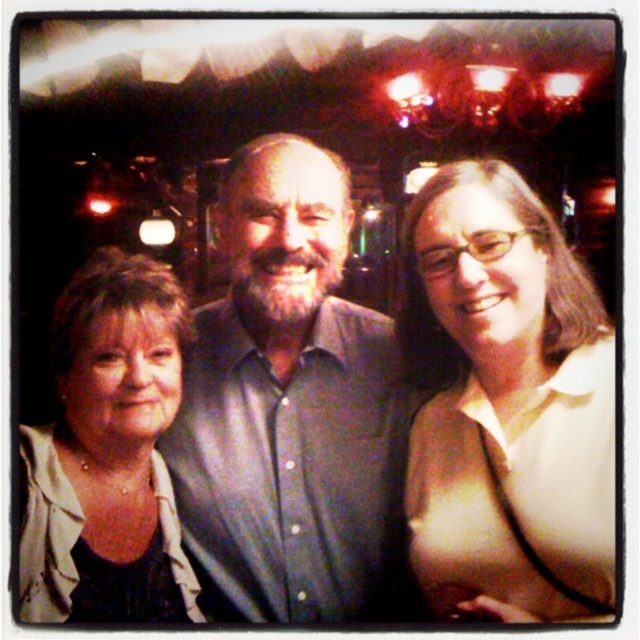
You are organizing a clothing display and need to place the matte white shirt at center and the matte beige jacket at lower left side by side. Based on their sizes, which one should be placed on the shelf first to ensure they fit properly?

The matte white shirt at center is wider than the matte beige jacket at lower left. Therefore, you should place the matte white shirt at center first to accommodate its greater width before positioning the matte beige jacket at lower left.

In the scene shown: You are at a party and need to find the matte white shirt at center and the matte beige jacket at lower left. Which one is higher in the image?

The matte white shirt at center is located above the matte beige jacket at lower left, so it is higher in the image.

You are a photographer trying to adjust the lighting for a group photo. You notice the matte green shirt at center and the matte beige jacket at lower left. Which clothing item is positioned to the right of the other?

The matte green shirt at center is positioned on the right side of the matte beige jacket at lower left.